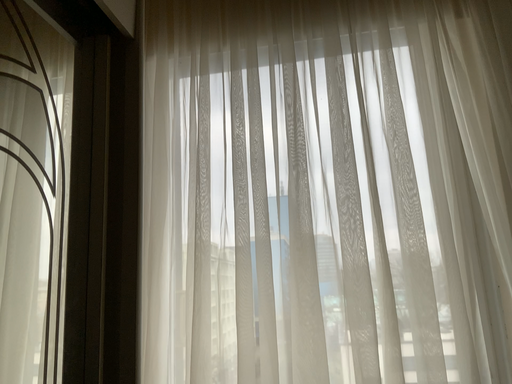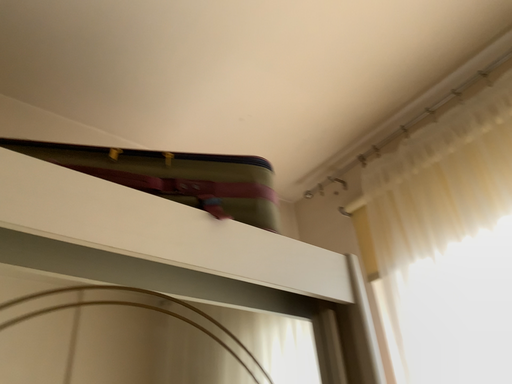
Question: Which way did the camera rotate in the video?

Choices:
 (A) rotated left
 (B) rotated right

Answer: (A)